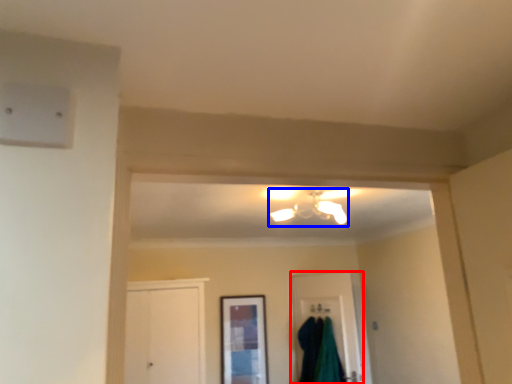
Question: Which point is further to the camera, door (highlighted by a red box) or light fixture (highlighted by a blue box)?

Choices:
 (A) door
 (B) light fixture

Answer: (A)